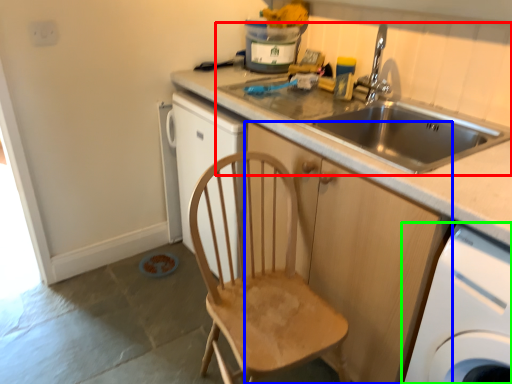
Question: Which object is positioned farthest from sink (highlighted by a red box)? Select from cabinetry (highlighted by a blue box) and home appliance (highlighted by a green box).

Choices:
 (A) cabinetry
 (B) home appliance

Answer: (B)